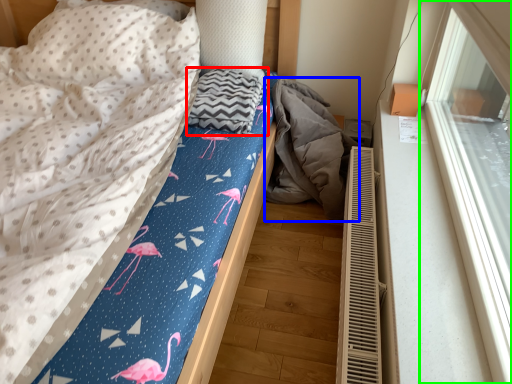
Question: Which object is positioned farthest from blanket (highlighted by a red box)? Select from material (highlighted by a blue box) and window (highlighted by a green box).

Choices:
 (A) material
 (B) window

Answer: (B)